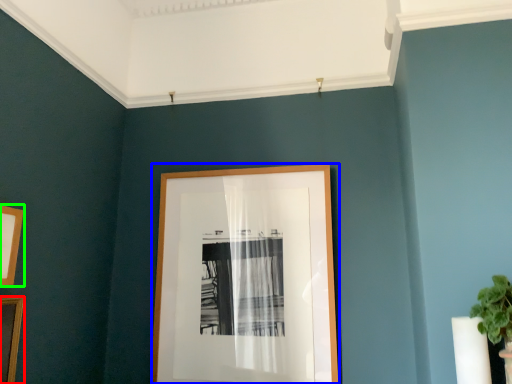
Question: Estimate the real-world distances between objects in this image. Which object is farther from picture frame (highlighted by a red box), picture frame (highlighted by a blue box) or picture frame (highlighted by a green box)?

Choices:
 (A) picture frame
 (B) picture frame

Answer: (A)